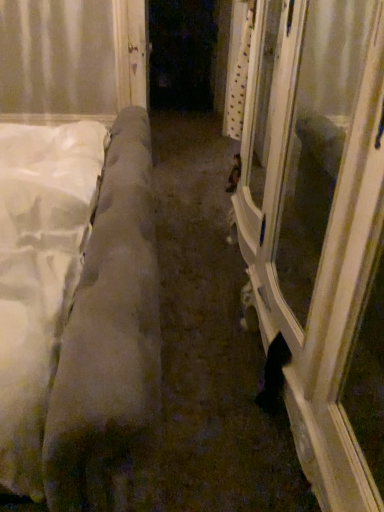
Question: Is white soft mattress at left wider than white glossy door at center?

Choices:
 (A) no
 (B) yes

Answer: (A)

Question: Would you say white soft mattress at left is outside white glossy door at center?

Choices:
 (A) yes
 (B) no

Answer: (A)

Question: Can you confirm if white soft mattress at left is positioned to the left of white glossy door at center?

Choices:
 (A) yes
 (B) no

Answer: (A)

Question: From a real-world perspective, is white soft mattress at left physically above white glossy door at center?

Choices:
 (A) yes
 (B) no

Answer: (A)

Question: Would you say white soft mattress at left is a long distance from white glossy door at center?

Choices:
 (A) yes
 (B) no

Answer: (B)

Question: Looking at the image, does white glossy door at center seem bigger or smaller compared to white soft mattress at left?

Choices:
 (A) big
 (B) small

Answer: (B)

Question: Choose the correct answer: Is white glossy door at center inside white soft mattress at left or outside it?

Choices:
 (A) outside
 (B) inside

Answer: (A)

Question: Would you say white glossy door at center is to the left or to the right of white soft mattress at left in the picture?

Choices:
 (A) right
 (B) left

Answer: (A)

Question: Looking at their shapes, would you say white glossy door at center is wider or thinner than white soft mattress at left?

Choices:
 (A) thin
 (B) wide

Answer: (B)

Question: Is white soft mattress at left taller or shorter than white glossy door at center?

Choices:
 (A) short
 (B) tall

Answer: (B)

Question: From the image's perspective, is white soft mattress at left above or below white glossy door at center?

Choices:
 (A) below
 (B) above

Answer: (A)

Question: Considering the relative positions of white soft mattress at left and white glossy door at center in the image provided, is white soft mattress at left to the left or to the right of white glossy door at center?

Choices:
 (A) right
 (B) left

Answer: (B)

Question: From a real-world perspective, relative to white glossy door at center, is white soft mattress at left vertically above or below?

Choices:
 (A) above
 (B) below

Answer: (B)

Question: From the image's perspective, is white glossy door at center above or below white soft mattress at left?

Choices:
 (A) below
 (B) above

Answer: (B)

Question: Considering the positions of white glossy door at center and white soft mattress at left in the image, is white glossy door at center bigger or smaller than white soft mattress at left?

Choices:
 (A) big
 (B) small

Answer: (B)